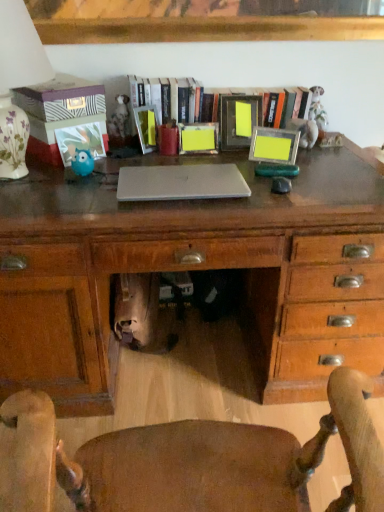
You are a GUI agent. You are given a task and a screenshot of the screen. Output one action in this format:
    pyautogui.click(x=<x>, y=<y>)
    Task: Click on the vacant space in front of wooden frame at center
    This screenshot has height=512, width=384.
    Given the screenshot: What is the action you would take?
    pyautogui.click(x=249, y=183)